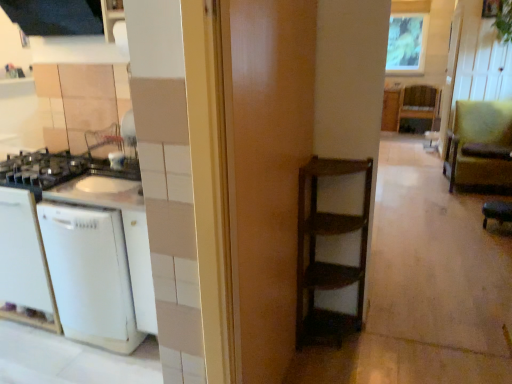
The height and width of the screenshot is (384, 512). What are the coordinates of `wooden door at center` in the screenshot? It's located at (266, 171).

Locate an element on the screen. The width and height of the screenshot is (512, 384). wooden frame at upper center is located at coordinates click(x=406, y=44).

Find the location of `wooden door at center`. wooden door at center is located at coordinates (266, 171).

Who is smaller, green fabric armchair at right or wooden frame at upper center?

wooden frame at upper center.

Which of these two, green fabric armchair at right or wooden frame at upper center, is thinner?

wooden frame at upper center is thinner.

Looking at this image, are green fabric armchair at right and wooden frame at upper center located far from each other?

Indeed, green fabric armchair at right is not near wooden frame at upper center.

Considering the positions of objects wooden frame at upper center and white matte dishwasher at left in the image provided, who is more to the left, wooden frame at upper center or white matte dishwasher at left?

white matte dishwasher at left is more to the left.

Is wooden frame at upper center positioned beyond the bounds of white matte dishwasher at left?

Yes, wooden frame at upper center is not within white matte dishwasher at left.

Considering the sizes of objects wooden frame at upper center and white matte dishwasher at left in the image provided, who is taller, wooden frame at upper center or white matte dishwasher at left?

wooden frame at upper center.

Which is in front, point (487, 220) or point (247, 25)?

The point (247, 25) is closer.

Is green leather bar stool at lower right to the left or to the right of wooden door at center in the image?

Based on their positions, green leather bar stool at lower right is located to the right of wooden door at center.

Is green leather bar stool at lower right bigger than wooden door at center?

No, green leather bar stool at lower right is not bigger than wooden door at center.

From a real-world perspective, which object stands above the other?

In real-world perspective, wooden door at center is above.

Which of these two, wooden frame at upper center or green fabric armchair at right, stands shorter?

With less height is green fabric armchair at right.

From the image's perspective, is wooden frame at upper center located above green fabric armchair at right?

Correct, wooden frame at upper center appears higher than green fabric armchair at right in the image.

Considering the positions of points (401, 29) and (485, 117), is point (401, 29) closer to camera compared to point (485, 117)?

No, (401, 29) is behind (485, 117).

Based on the photo, is white matte dishwasher at left taller than wooden shelf at center?

Incorrect, the height of white matte dishwasher at left is not larger of that of wooden shelf at center.

From the image's perspective, does white matte dishwasher at left appear lower than wooden shelf at center?

Yes.

Looking at this image, is white matte dishwasher at left completely or partially outside of wooden shelf at center?

white matte dishwasher at left is positioned outside wooden shelf at center.

Are white matte dishwasher at left and wooden shelf at center beside each other?

No, white matte dishwasher at left is not next to wooden shelf at center.

Which object is further away from the camera taking this photo, white matte dishwasher at left or wooden door at center?

Positioned behind is white matte dishwasher at left.

How much distance is there between white matte dishwasher at left and wooden door at center?

white matte dishwasher at left is 37.78 inches away from wooden door at center.

Can you confirm if white matte dishwasher at left is bigger than wooden door at center?

Yes.

Between point (74, 271) and point (270, 277), which one is positioned behind?

Point (74, 271)

Is green leather bar stool at lower right at the left side of wooden shelf at center?

Indeed, green leather bar stool at lower right is positioned on the left side of wooden shelf at center.

From the image's perspective, does green leather bar stool at lower right appear higher than wooden shelf at center?

Incorrect, from the image's perspective, green leather bar stool at lower right is lower than wooden shelf at center.

Considering the sizes of objects green leather bar stool at lower right and wooden shelf at center in the image provided, who is thinner, green leather bar stool at lower right or wooden shelf at center?

With smaller width is green leather bar stool at lower right.

Where is `armchair below the wooden frame at upper center (from the image's perspective)`? armchair below the wooden frame at upper center (from the image's perspective) is located at coordinates (480, 145).

Where is `dish washer that appears below the wooden frame at upper center (from a real-world perspective)`? dish washer that appears below the wooden frame at upper center (from a real-world perspective) is located at coordinates (90, 275).

Considering their positions, is wooden frame at upper center positioned closer to white matte dishwasher at left than green leather bar stool at lower right?

green leather bar stool at lower right is closer to white matte dishwasher at left.

Looking at the image, which one is located closer to white matte dishwasher at left, green leather bar stool at lower right or wooden shelf at center?

Among the two, green leather bar stool at lower right is located nearer to white matte dishwasher at left.

Looking at the image, which one is located closer to green fabric armchair at right, green leather bar stool at lower right or wooden frame at upper center?

Based on the image, green leather bar stool at lower right appears to be nearer to green fabric armchair at right.

Based on their spatial positions, is white matte dishwasher at left or green fabric armchair at right further from green leather bar stool at lower right?

white matte dishwasher at left lies further to green leather bar stool at lower right than the other object.

Estimate the real-world distances between objects in this image. Which object is further from green leather bar stool at lower right, green fabric armchair at right or white matte dishwasher at left?

Among the two, white matte dishwasher at left is located further to green leather bar stool at lower right.

Estimate the real-world distances between objects in this image. Which object is further from wooden shelf at center, wooden door at center or white matte dishwasher at left?

The object further to wooden shelf at center is white matte dishwasher at left.

Looking at the image, which one is located closer to green fabric armchair at right, wooden shelf at center or green leather bar stool at lower right?

green leather bar stool at lower right is positioned closer to the anchor green fabric armchair at right.

Based on the photo, which object lies further to the anchor point green fabric armchair at right, wooden shelf at center or white matte dishwasher at left?

white matte dishwasher at left is further to green fabric armchair at right.

Identify the location of door located between white matte dishwasher at left and green leather bar stool at lower right in the left-right direction. (266, 171).

Where is `armchair positioned between wooden door at center and wooden frame at upper center from near to far`? The image size is (512, 384). armchair positioned between wooden door at center and wooden frame at upper center from near to far is located at coordinates (480, 145).

Locate an element on the screen. The image size is (512, 384). furniture between green fabric armchair at right and wooden frame at upper center in the front-back direction is located at coordinates (418, 103).

Locate an element on the screen. This screenshot has height=384, width=512. armchair between green leather bar stool at lower right and wooden shelf at center along the z-axis is located at coordinates (480, 145).